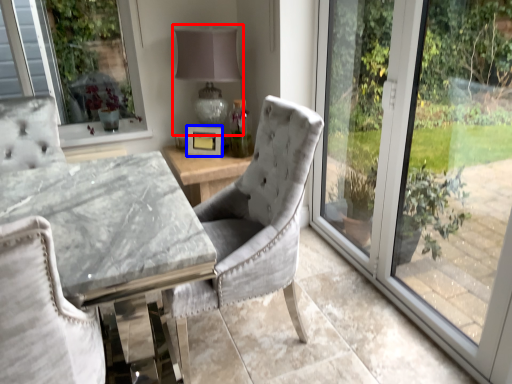
Question: Which of the following is the closest to the observer, table lamp (highlighted by a red box) or picture frame (highlighted by a blue box)?

Choices:
 (A) table lamp
 (B) picture frame

Answer: (A)